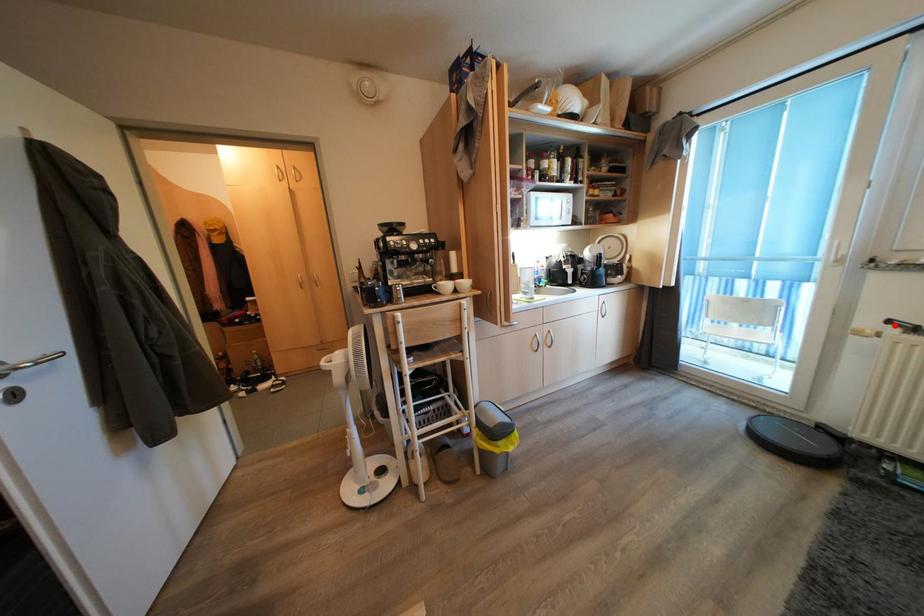
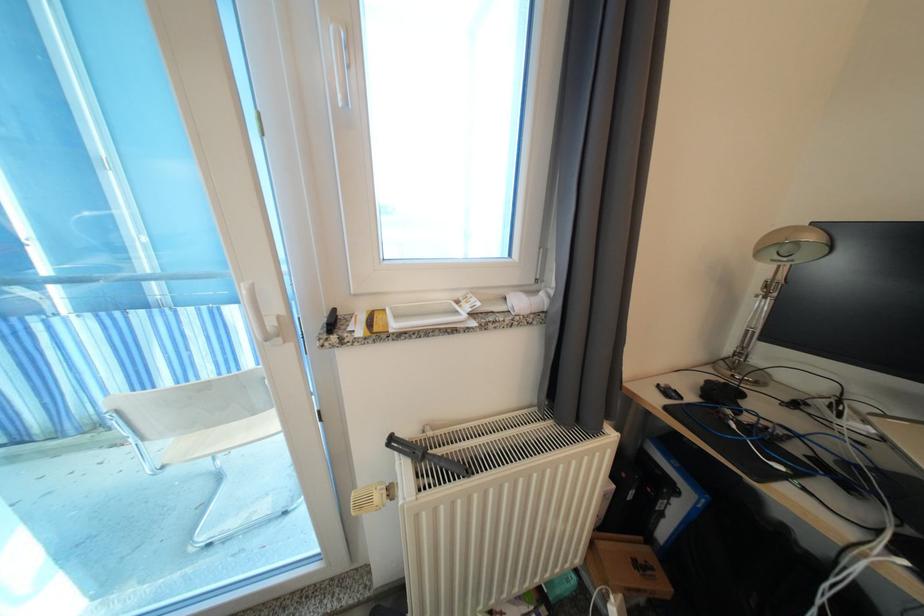
Question: I am providing you with two images of the same scene from different viewpoints. In image1, a red point is highlighted. Considering the same 3D point in image2, which of the following is correct?

Choices:
 (A) It is closer
 (B) It is farther

Answer: (A)